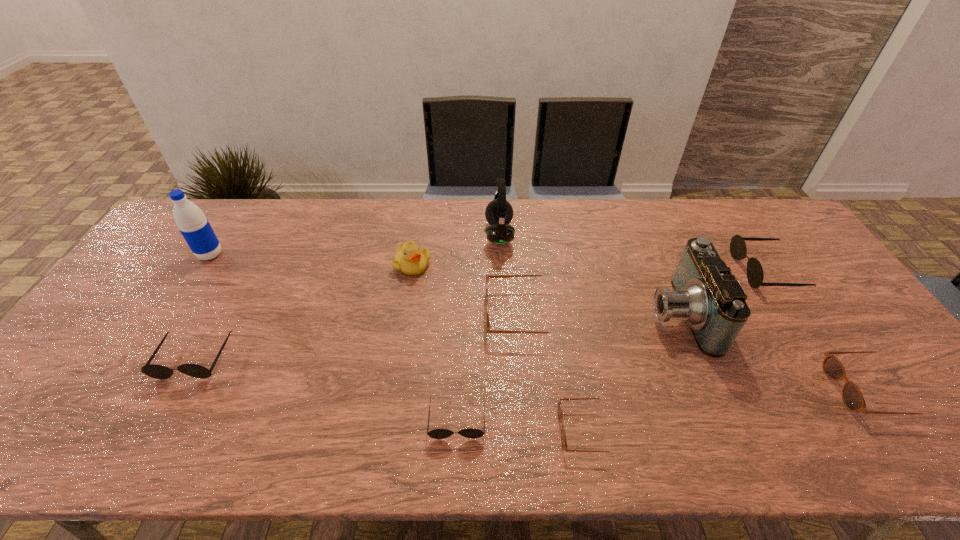
Image resolution: width=960 pixels, height=540 pixels. I want to click on vacant space situated 0.120m on the front-facing side of the leftmost sunglasses, so click(157, 427).

Identify the location of vacant space positioned on the front-facing side of the rightmost brown sunglasses. This screenshot has height=540, width=960. pos(677,390).

What are the coordinates of `vacant region located on the front-facing side of the rightmost brown sunglasses` in the screenshot? It's located at (743, 390).

I want to click on vacant area situated on the front-facing side of the rightmost brown sunglasses, so click(702, 390).

This screenshot has width=960, height=540. What are the coordinates of `free region located on the front-facing side of the smallest brown sunglasses` in the screenshot? It's located at (431, 430).

Image resolution: width=960 pixels, height=540 pixels. What are the coordinates of `vacant position located on the front-facing side of the smallest brown sunglasses` in the screenshot? It's located at (418, 430).

Where is `free space located 0.150m on the front-facing side of the smallest brown sunglasses`? free space located 0.150m on the front-facing side of the smallest brown sunglasses is located at coordinates pos(492,430).

This screenshot has height=540, width=960. I want to click on object situated at the far edge, so click(499, 213).

This screenshot has height=540, width=960. Identify the location of object present at the left edge. (195, 228).

The image size is (960, 540). I want to click on object at the near right corner, so click(x=853, y=399).